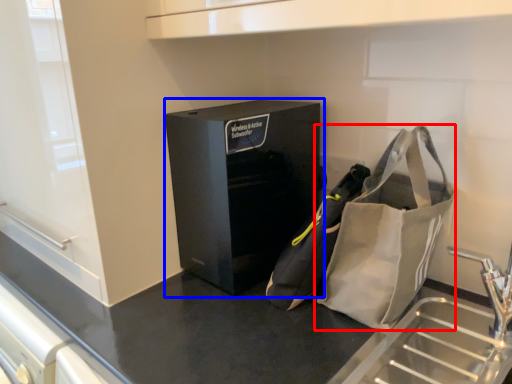
Question: Which object is further to the camera taking this photo, handbag (highlighted by a red box) or furniture (highlighted by a blue box)?

Choices:
 (A) handbag
 (B) furniture

Answer: (B)